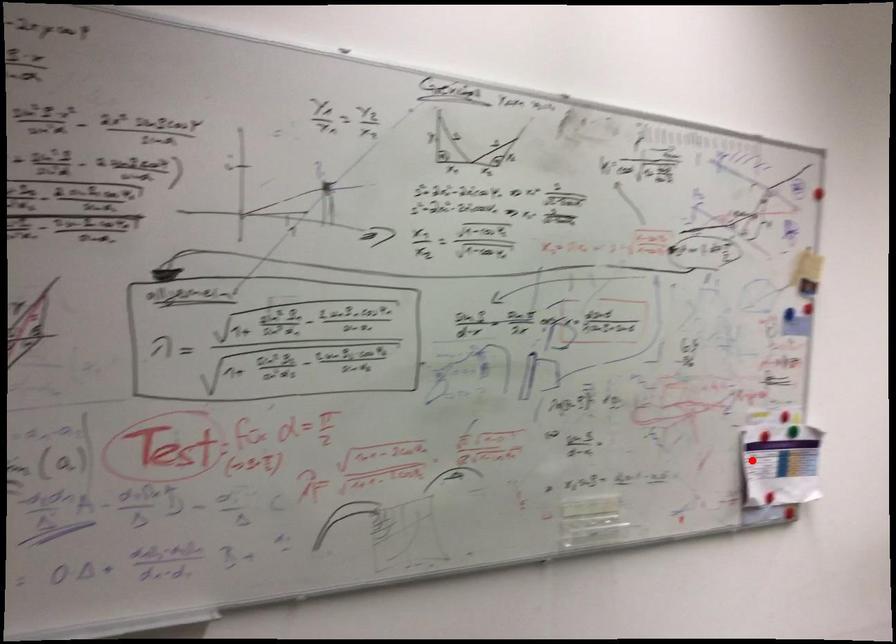
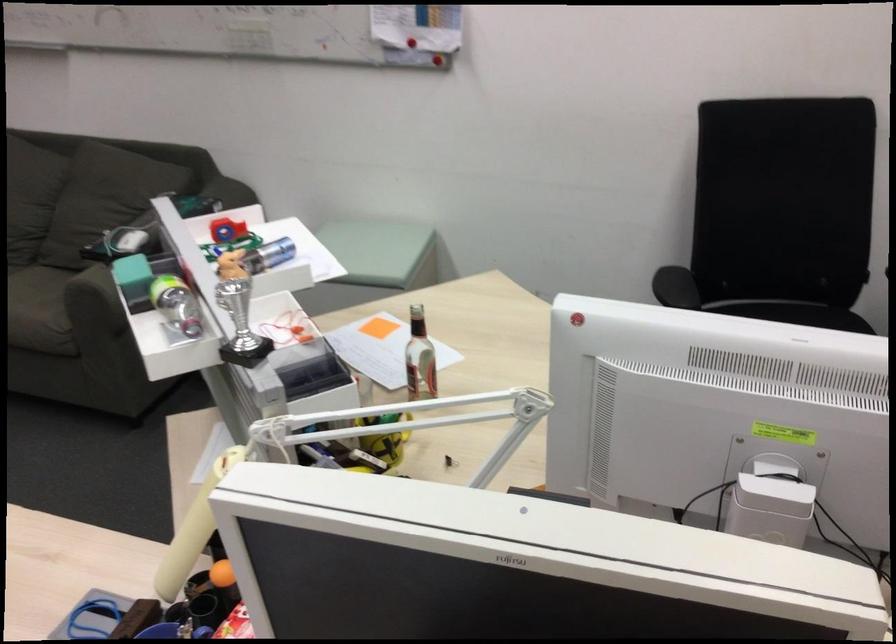
Question: I am providing you with two images of the same scene from different viewpoints. Given a red point in image1, look at the same physical point in image2. Is it:

Choices:
 (A) Closer to the viewpoint
 (B) Farther from the viewpoint

Answer: (B)